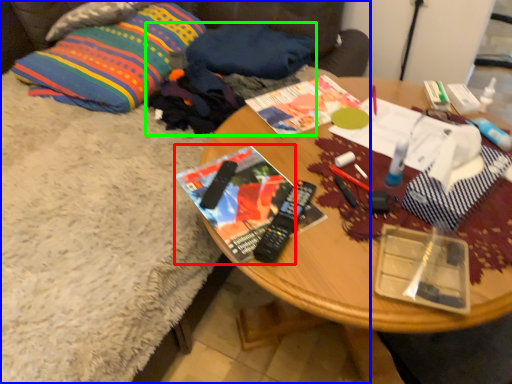
Question: Based on their relative distances, which object is nearer to magazine (highlighted by a red box)? Choose from studio couch (highlighted by a blue box) and clothing (highlighted by a green box).

Choices:
 (A) studio couch
 (B) clothing

Answer: (B)